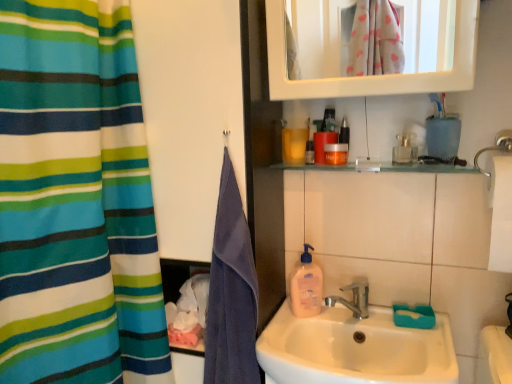
Question: From a real-world perspective, does purple cotton towel at left stand above translucent plastic soap dispenser at sink?

Choices:
 (A) no
 (B) yes

Answer: (B)

Question: From the image's perspective, is purple cotton towel at left over translucent plastic soap dispenser at sink?

Choices:
 (A) no
 (B) yes

Answer: (B)

Question: Is purple cotton towel at left further to camera compared to translucent plastic soap dispenser at sink?

Choices:
 (A) yes
 (B) no

Answer: (B)

Question: Is purple cotton towel at left oriented away from translucent plastic soap dispenser at sink?

Choices:
 (A) yes
 (B) no

Answer: (B)

Question: Is purple cotton towel at left aimed at translucent plastic soap dispenser at sink?

Choices:
 (A) no
 (B) yes

Answer: (A)

Question: Does purple cotton towel at left have a greater height compared to translucent plastic soap dispenser at sink?

Choices:
 (A) no
 (B) yes

Answer: (B)

Question: Is translucent plastic bottle at upper center, the 1th mouthwash when ordered from left to right, positioned in front of orange matte bottle at upper center, which appears as the 2th mouthwash when viewed from the right?

Choices:
 (A) no
 (B) yes

Answer: (B)

Question: Considering the relative sizes of translucent plastic bottle at upper center, the 1th mouthwash when ordered from left to right, and orange matte bottle at upper center, which appears as the 2th mouthwash when viewed from the right, in the image provided, is translucent plastic bottle at upper center, the 1th mouthwash when ordered from left to right, thinner than orange matte bottle at upper center, which appears as the 2th mouthwash when viewed from the right,?

Choices:
 (A) no
 (B) yes

Answer: (A)

Question: Is translucent plastic bottle at upper center, the fourth mouthwash from the right, next to orange matte bottle at upper center, which appears as the 2th mouthwash when viewed from the right, and touching it?

Choices:
 (A) no
 (B) yes

Answer: (B)

Question: Is translucent plastic bottle at upper center, the fourth mouthwash from the right, at the left side of orange matte bottle at upper center, which appears as the 2th mouthwash when viewed from the right?

Choices:
 (A) no
 (B) yes

Answer: (B)

Question: Considering the relative sizes of translucent plastic bottle at upper center, the 1th mouthwash when ordered from left to right, and orange matte bottle at upper center, which appears as the 2th mouthwash when viewed from the right, in the image provided, is translucent plastic bottle at upper center, the 1th mouthwash when ordered from left to right, bigger than orange matte bottle at upper center, which appears as the 2th mouthwash when viewed from the right,?

Choices:
 (A) yes
 (B) no

Answer: (B)

Question: Is translucent plastic bottle at upper center, the fourth mouthwash from the right, taller than orange matte bottle at upper center, which appears as the 2th mouthwash when viewed from the right?

Choices:
 (A) no
 (B) yes

Answer: (A)

Question: Considering the relative positions of striped fabric curtain at left and translucent plastic bottle at upper center, the 1th mouthwash when ordered from left to right, in the image provided, is striped fabric curtain at left to the right of translucent plastic bottle at upper center, the 1th mouthwash when ordered from left to right, from the viewer's perspective?

Choices:
 (A) no
 (B) yes

Answer: (A)